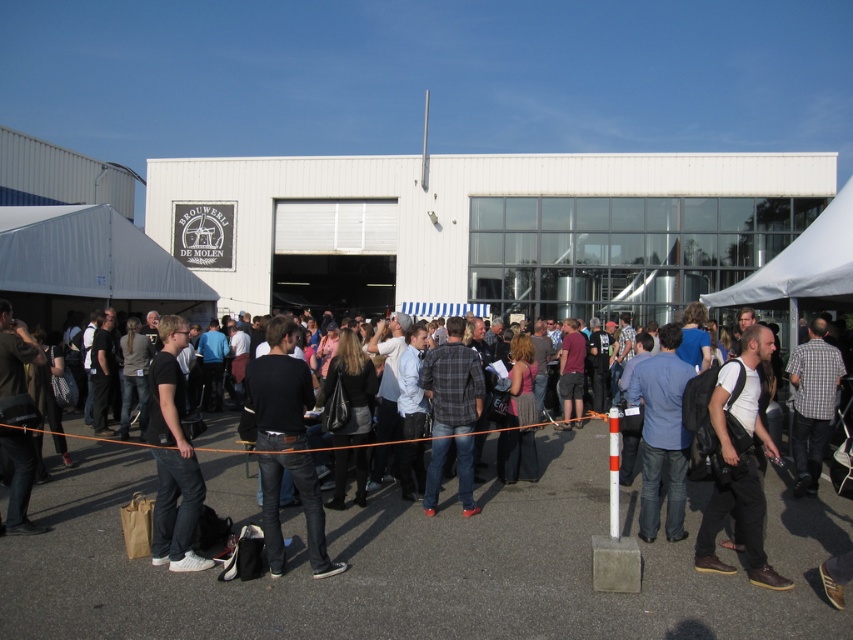
Which is behind, point (680, 332) or point (16, 477)?

The point (16, 477) is more distant.

Who is more distant from viewer, (654, 513) or (27, 403)?

The point (654, 513) is more distant.

Locate an element on the screen. Image resolution: width=853 pixels, height=640 pixels. blue denim jeans at center is located at coordinates 662,435.

Does black leather jacket at center lie in front of checkered shirt at center?

Yes.

Between black leather jacket at center and checkered shirt at center, which one appears on the left side from the viewer's perspective?

black leather jacket at center is more to the left.

Between point (276, 449) and point (788, 362), which one is positioned in front?

Point (276, 449)

Where is `black leather jacket at center`? The height and width of the screenshot is (640, 853). black leather jacket at center is located at coordinates (285, 444).

Who is lower down, white matte shirt at center-right or dark gray jeans at lower left?

Positioned lower is white matte shirt at center-right.

Does white matte shirt at center-right have a greater height compared to dark gray jeans at lower left?

Incorrect, white matte shirt at center-right's height is not larger of dark gray jeans at lower left's.

The image size is (853, 640). Describe the element at coordinates (740, 465) in the screenshot. I see `white matte shirt at center-right` at that location.

Where is `white matte shirt at center-right`? white matte shirt at center-right is located at coordinates point(740,465).